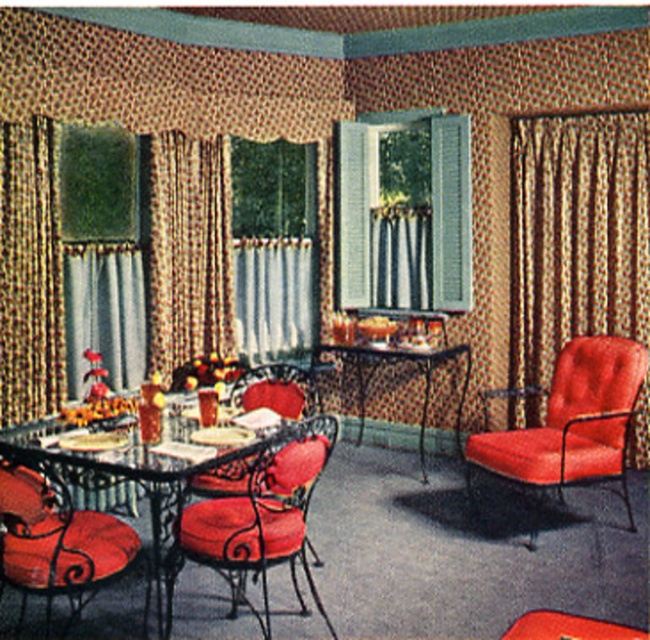
Who is lower down, velvet red chair at center or white sheer curtain at center?

velvet red chair at center is lower down.

This screenshot has height=640, width=650. I want to click on velvet red chair at center, so [255, 520].

Does brown textured curtain at left appear on the right side of white sheer curtain at center?

No, brown textured curtain at left is not to the right of white sheer curtain at center.

Is point (156, 221) more distant than point (281, 321)?

No, it is in front of (281, 321).

The image size is (650, 640). Identify the location of brown textured curtain at left. (185, 248).

Is brown textured curtain at left shorter than velvet orange armchair at right?

Incorrect, brown textured curtain at left's height does not fall short of velvet orange armchair at right's.

Which is behind, point (209, 176) or point (595, 444)?

The point (209, 176) is more distant.

Who is more distant from viewer, (198, 314) or (549, 416)?

Positioned behind is point (198, 314).

What are the coordinates of `brown textured curtain at left` in the screenshot? It's located at (185, 248).